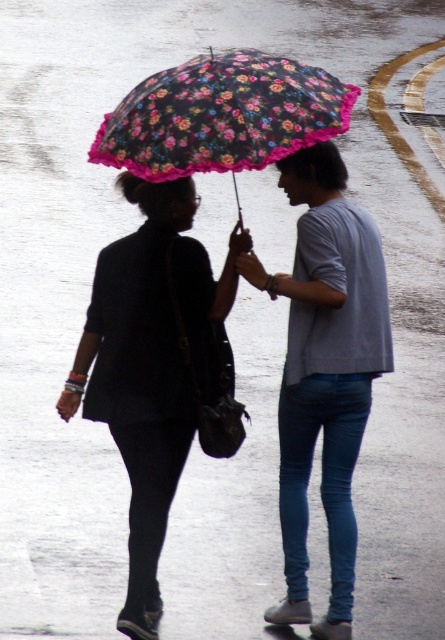
Question: Which object appears farthest from the camera in this image?

Choices:
 (A) floral-patterned fabric umbrella at upper center
 (B) light gray cotton shirt at center

Answer: (B)

Question: Considering the relative positions of matte black jacket at left and floral-patterned fabric umbrella at upper center in the image provided, where is matte black jacket at left located with respect to floral-patterned fabric umbrella at upper center?

Choices:
 (A) left
 (B) right

Answer: (A)

Question: Which object is positioned closest to the matte black jacket at left?

Choices:
 (A) light gray cotton shirt at center
 (B) floral-patterned fabric umbrella at upper center

Answer: (A)

Question: Is matte black jacket at left bigger than floral-patterned fabric umbrella at upper center?

Choices:
 (A) yes
 (B) no

Answer: (A)

Question: Can you confirm if matte black jacket at left is bigger than floral-patterned fabric umbrella at upper center?

Choices:
 (A) no
 (B) yes

Answer: (B)

Question: Which point is farther from the camera taking this photo?

Choices:
 (A) (138, 458)
 (B) (343, 104)

Answer: (B)